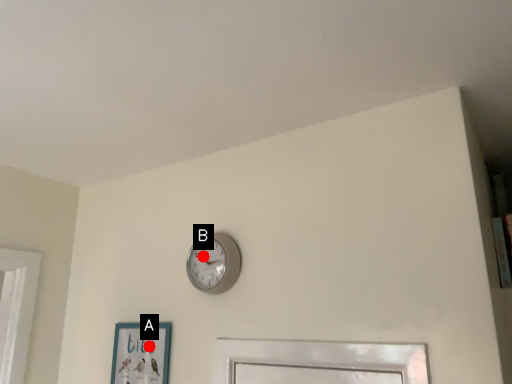
Question: Two points are circled on the image, labeled by A and B beside each circle. Which point is closer to the camera?

Choices:
 (A) A is closer
 (B) B is closer

Answer: (B)